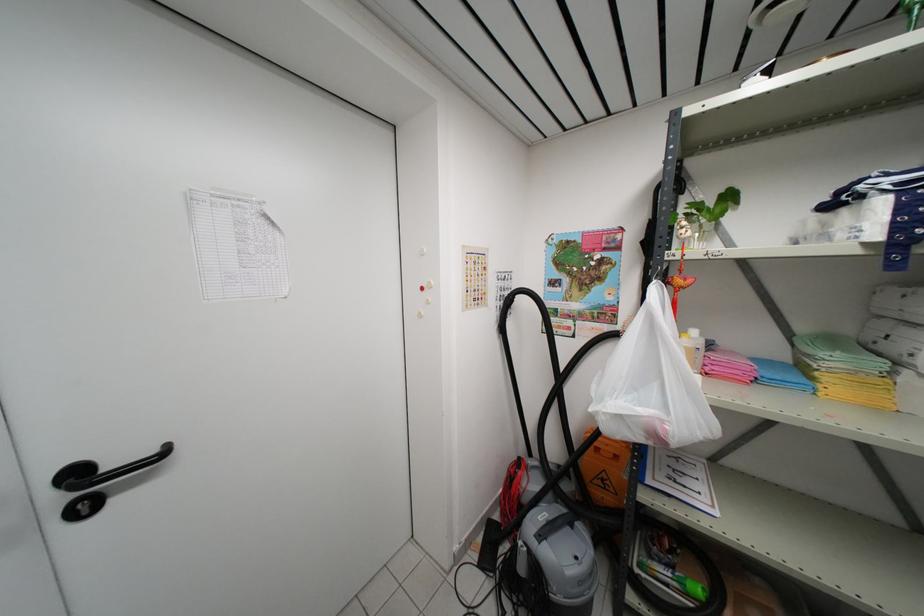
What are the coordinates of `black door handle` in the screenshot? It's located at (98, 482).